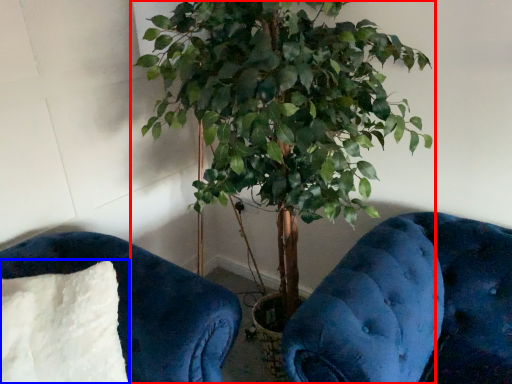
Question: Among these objects, which one is farthest to the camera, houseplant (highlighted by a red box) or pillow (highlighted by a blue box)?

Choices:
 (A) houseplant
 (B) pillow

Answer: (B)